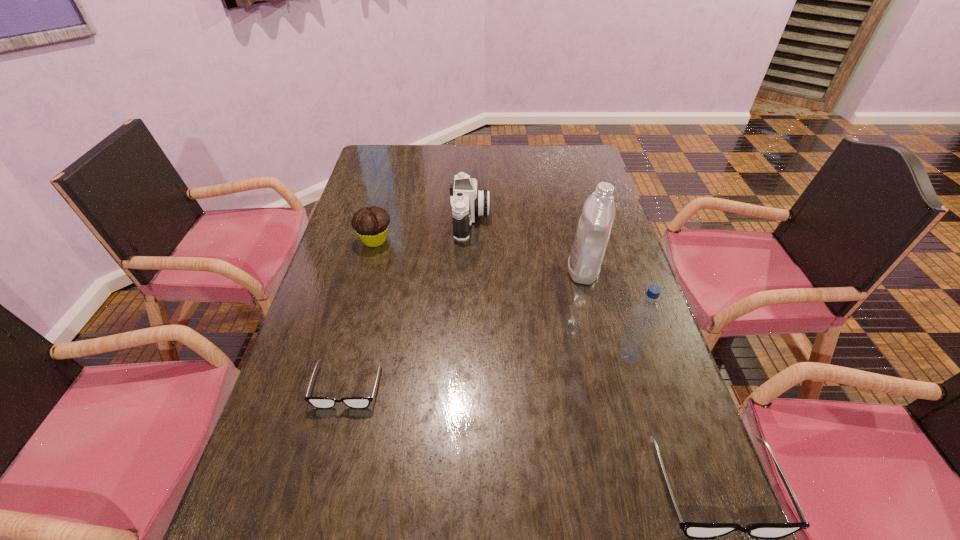
Find the location of a particular element. The width and height of the screenshot is (960, 540). vacant space located on the front of the detergent is located at coordinates (605, 358).

Locate an element on the screen. The image size is (960, 540). vacant region located 0.070m on the left of the camera is located at coordinates (430, 220).

Find the location of a particular element. Image resolution: width=960 pixels, height=540 pixels. free location located on the front of the second tallest object is located at coordinates click(x=637, y=385).

Where is `spectacles that is at the left edge`? spectacles that is at the left edge is located at coordinates (318, 402).

The height and width of the screenshot is (540, 960). Identify the location of muffin positioned at the left edge. click(371, 224).

Find the location of a particular element. detergent at the right edge is located at coordinates (592, 235).

Where is `water bottle at the right edge`? The image size is (960, 540). water bottle at the right edge is located at coordinates (644, 317).

Find the location of a particular element. vacant space at the far edge of the desktop is located at coordinates [509, 167].

This screenshot has height=540, width=960. I want to click on vacant space at the left edge of the desktop, so click(389, 224).

In the image, there is a desktop. At what (x,y) coordinates should I click in order to perform the action: click on free space at the right edge. Please return your answer as a coordinate pair (x, y). Looking at the image, I should click on (575, 195).